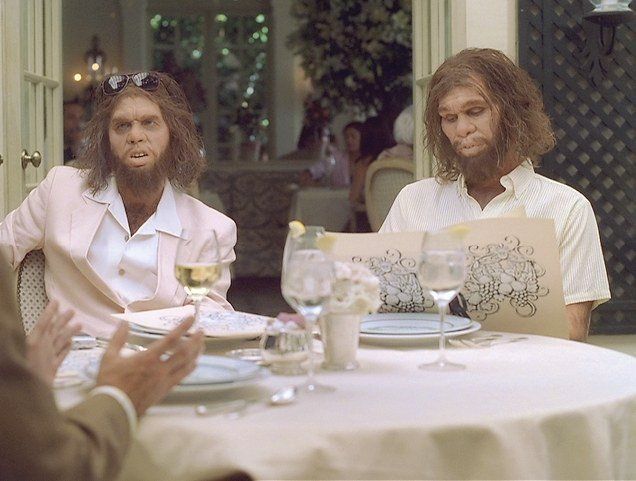
The image size is (636, 481). I want to click on water in glass, so click(x=310, y=297), click(x=446, y=295).